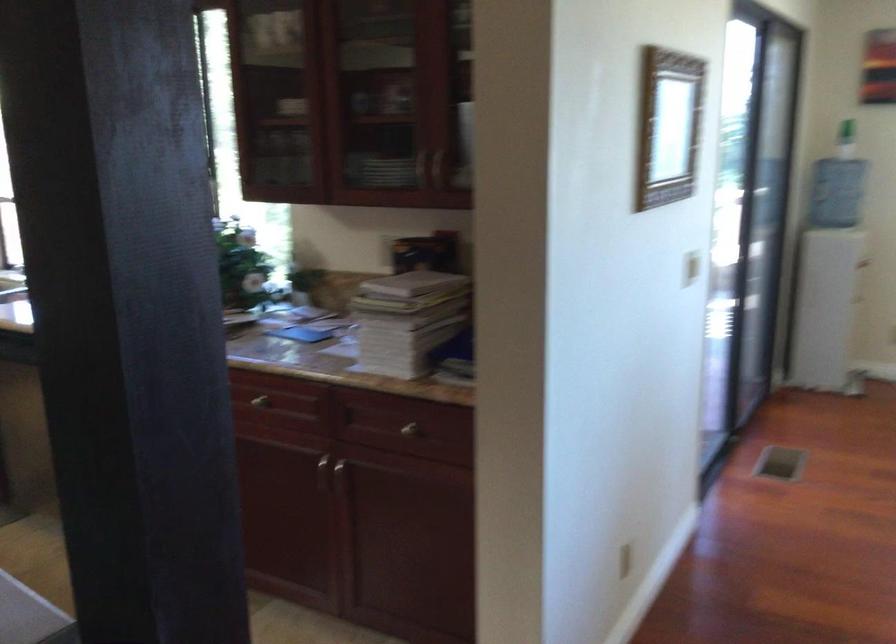
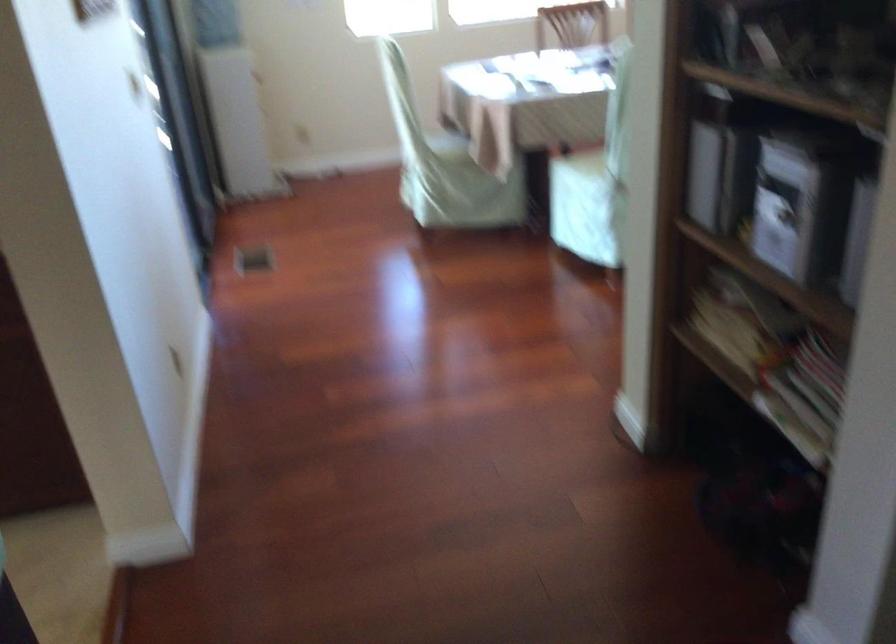
Question: The camera is either moving clockwise (left) or counter-clockwise (right) around the object. The first image is from the beginning of the video and the second image is from the end. Is the camera moving left or right when shooting the video?

Choices:
 (A) Left
 (B) Right

Answer: (A)